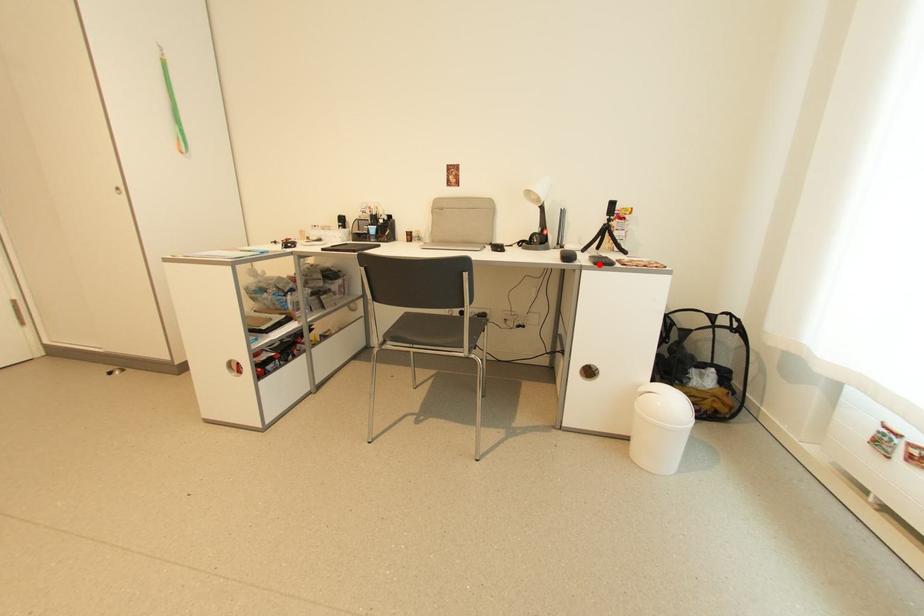
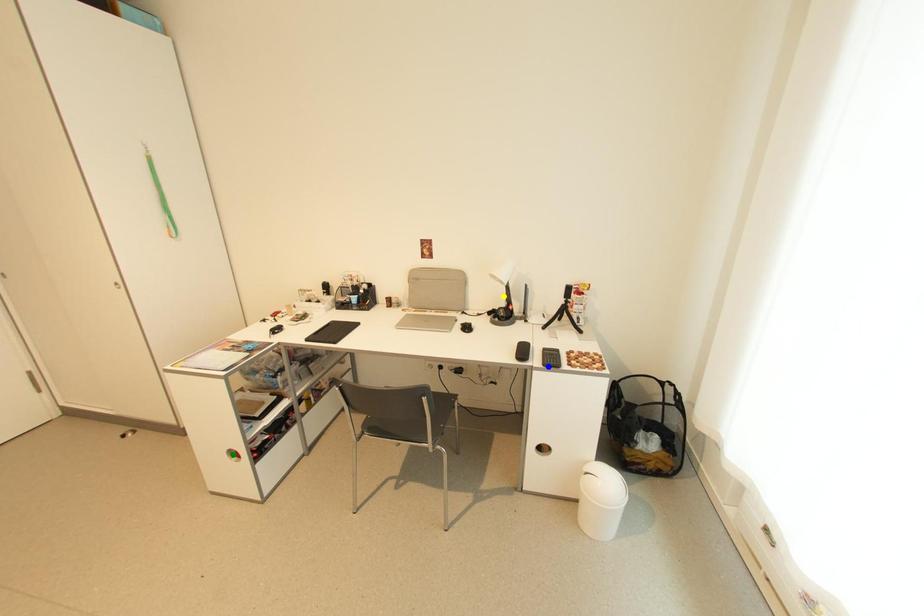
Question: I am providing you with two images of the same scene from different viewpoints. A red point is marked on the first image. You are given multiple points on the second image. In image 2, which mark is for the same physical point as the one in image 1?

Choices:
 (A) blue point
 (B) green point
 (C) yellow point

Answer: (A)